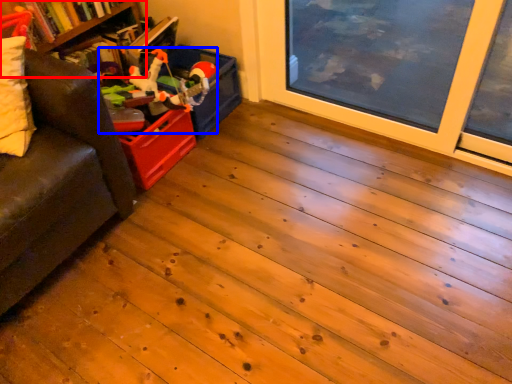
Question: Which object is further to the camera taking this photo, bookshelf (highlighted by a red box) or toy (highlighted by a blue box)?

Choices:
 (A) bookshelf
 (B) toy

Answer: (B)